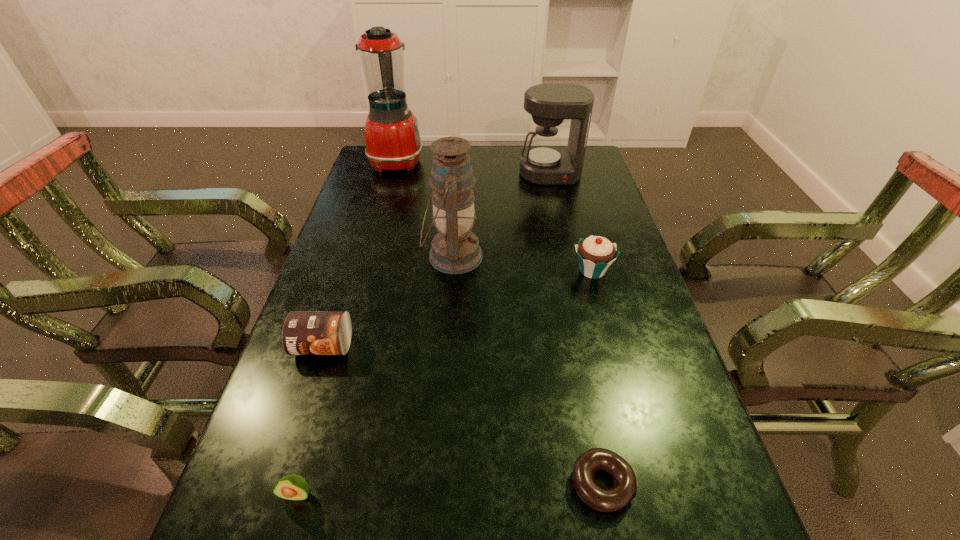
At what (x,y) coordinates should I click in order to perform the action: click on food processor. Please return your answer as a coordinate pair (x, y). This screenshot has height=540, width=960. Looking at the image, I should click on (392, 137).

Locate an element on the screen. Image resolution: width=960 pixels, height=540 pixels. the fourth object from right to left is located at coordinates (455, 249).

Where is `the second tallest object`? This screenshot has height=540, width=960. the second tallest object is located at coordinates (455, 249).

Where is `coffee maker`? The height and width of the screenshot is (540, 960). coffee maker is located at coordinates (546, 163).

Locate an element on the screen. This screenshot has width=960, height=540. cupcake is located at coordinates (595, 253).

I want to click on the third nearest object, so click(304, 332).

Where is `avocado`? Image resolution: width=960 pixels, height=540 pixels. avocado is located at coordinates (291, 487).

Where is `doughnut`? The width and height of the screenshot is (960, 540). doughnut is located at coordinates (599, 498).

Find the location of a particular element. The height and width of the screenshot is (540, 960). free space located 0.070m on the controls of the tallest object is located at coordinates [x=444, y=161].

The height and width of the screenshot is (540, 960). I want to click on free point located 0.400m on the front of the fourth object from left to right, so click(x=441, y=431).